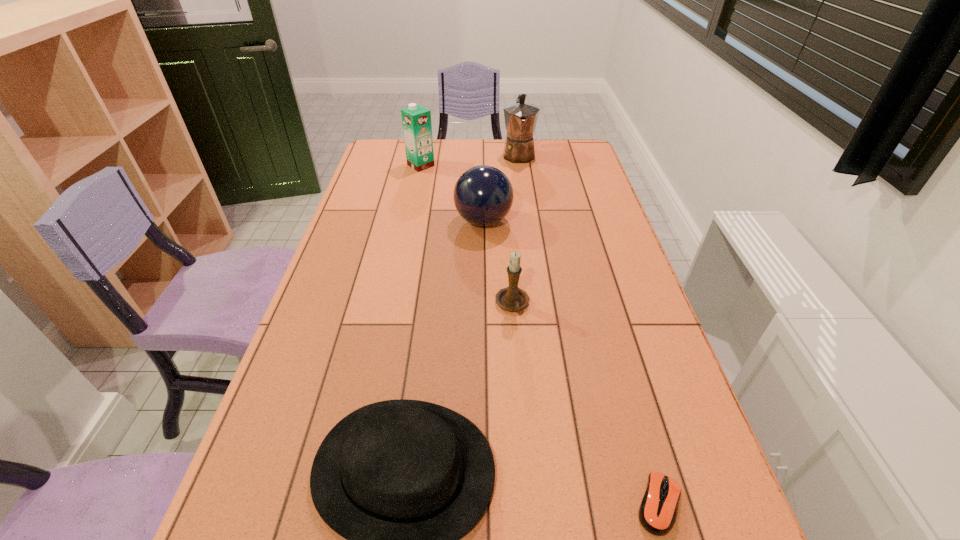
You are a GUI agent. You are given a task and a screenshot of the screen. Output one action in this format:
    pyautogui.click(x=<x>, y=<y>)
    Task: Click on the coffeepot
    
    Given the screenshot: What is the action you would take?
    pyautogui.click(x=521, y=118)

You are a GUI agent. You are given a task and a screenshot of the screen. Output one action in this format:
    pyautogui.click(x=<x>, y=<y>)
    Task: Click on the carton
    
    Given the screenshot: What is the action you would take?
    pyautogui.click(x=416, y=120)

You are a GUI agent. You are given a task and a screenshot of the screen. Output one action in this format:
    pyautogui.click(x=<x>, y=<y>)
    Task: Click on the bowling ball
    Image resolution: width=960 pixels, height=540 pixels.
    Given the screenshot: What is the action you would take?
    pyautogui.click(x=483, y=195)

You are a GUI agent. You are given a task and a screenshot of the screen. Output one action in this format:
    pyautogui.click(x=<x>, y=<y>)
    Task: Click on the candle holder
    The width and height of the screenshot is (960, 540).
    Given the screenshot: What is the action you would take?
    pyautogui.click(x=511, y=298)

Where is `the rightmost object`? the rightmost object is located at coordinates (658, 509).

Image resolution: width=960 pixels, height=540 pixels. Find the location of `computer mouse`. computer mouse is located at coordinates (658, 509).

Find the location of a particular element. Image resolution: width=960 pixels, height=540 pixels. free location located 0.400m on the pouring side of the coffeepot is located at coordinates (529, 228).

Find the location of a particular element. This screenshot has width=960, height=540. vacant position located 0.360m on the front of the carton is located at coordinates [408, 228].

Locate an element on the screen. The image size is (960, 540). free space located 0.250m on the surface of the third farthest object near the finger holes is located at coordinates (377, 221).

Find the location of a particular element. This screenshot has width=960, height=540. vacant space located 0.070m on the surface of the third farthest object near the finger holes is located at coordinates (433, 221).